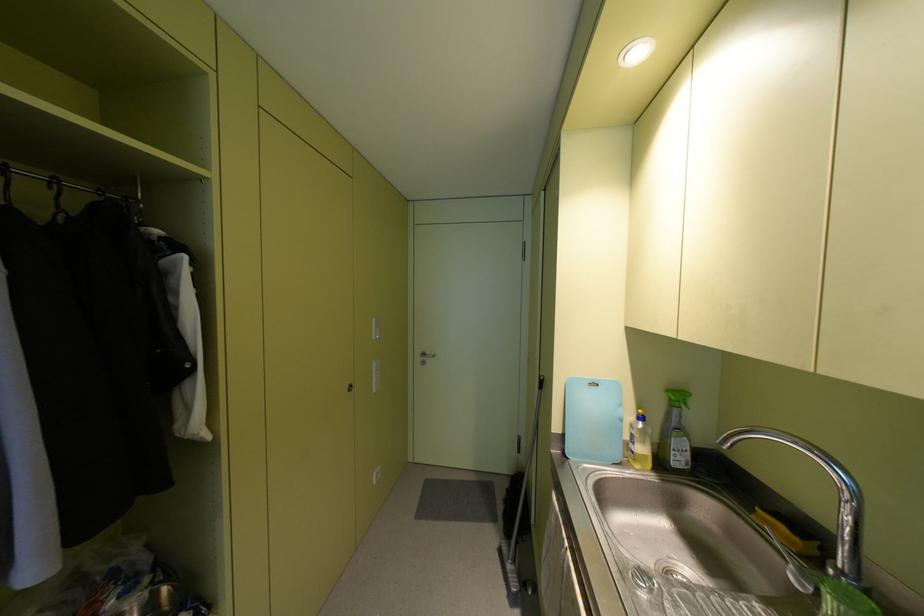
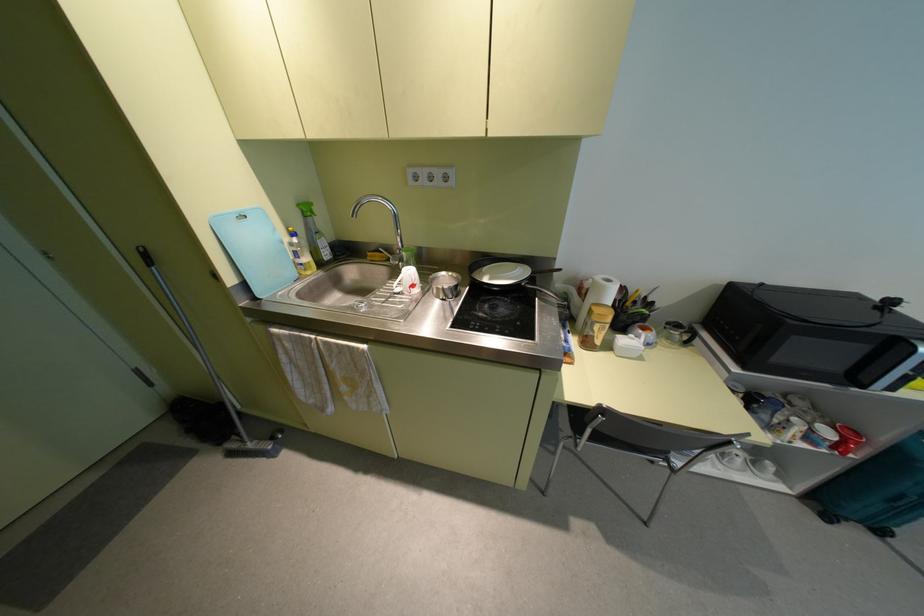
Locate, in the second image, the point that corresponds to point 621,419 in the first image.

(282, 241)